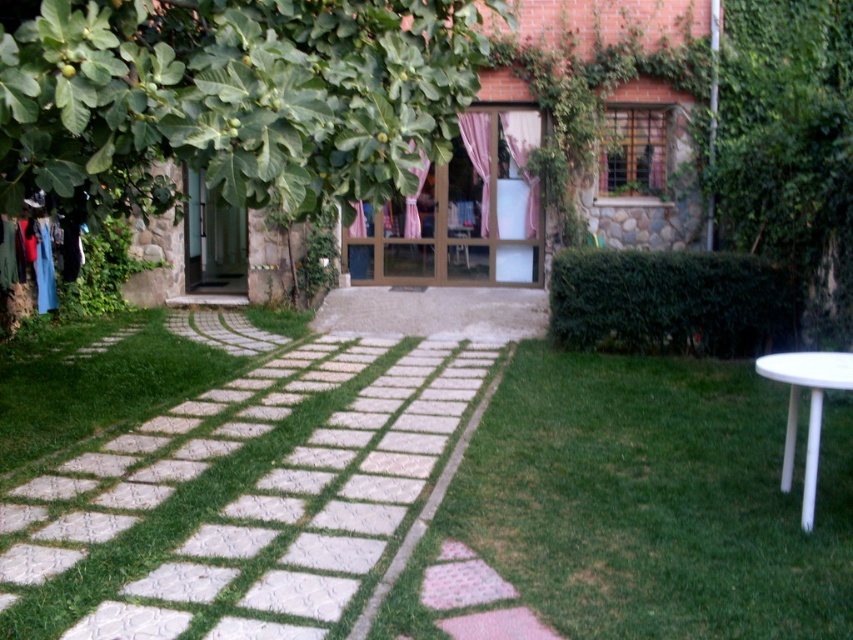
Does white sheer curtain at center appear on the left side of pink fabric curtain at center?

No, white sheer curtain at center is not to the left of pink fabric curtain at center.

Does point (518, 122) come closer to viewer compared to point (424, 157)?

No.

Where is `white sheer curtain at center`? This screenshot has height=640, width=853. white sheer curtain at center is located at coordinates [x=524, y=157].

Is white plastic table at right to the right of pink fabric curtain at center from the viewer's perspective?

Yes, white plastic table at right is to the right of pink fabric curtain at center.

This screenshot has width=853, height=640. Identify the location of white plastic table at right. (809, 408).

Between point (755, 371) and point (410, 236), which one is positioned behind?

Positioned behind is point (410, 236).

You are a GUI agent. You are given a task and a screenshot of the screen. Output one action in this format:
    pyautogui.click(x=<x>, y=<y>)
    Task: Click on the white plastic table at right
    This screenshot has width=853, height=640.
    Given the screenshot: What is the action you would take?
    pyautogui.click(x=809, y=408)

Does matte glass door at center have a lesser height compared to white sheer curtain at center?

Incorrect, matte glass door at center's height does not fall short of white sheer curtain at center's.

Does matte glass door at center appear over white sheer curtain at center?

No.

The image size is (853, 640). What are the coordinates of `matte glass door at center` in the screenshot? It's located at (462, 212).

Find the location of `matte glass door at center`. matte glass door at center is located at coordinates (462, 212).